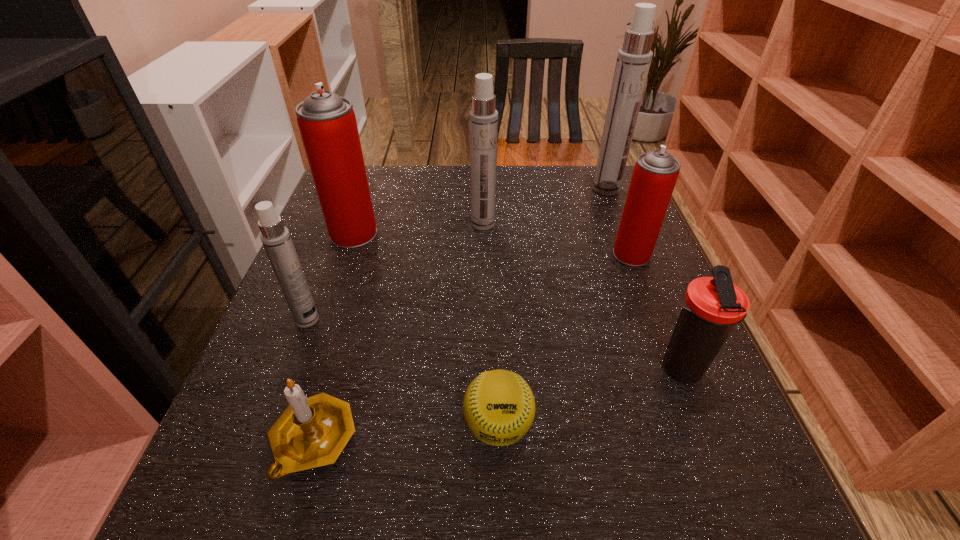
The width and height of the screenshot is (960, 540). In order to click on the farthest aerosol can in this screenshot , I will do `click(633, 62)`.

In order to click on the tallest object in this screenshot , I will do `click(633, 62)`.

Find the location of `the second smallest white aerosol can`. the second smallest white aerosol can is located at coordinates (483, 118).

Where is `the third aerosol can from left to right`? This screenshot has width=960, height=540. the third aerosol can from left to right is located at coordinates (483, 118).

I want to click on the left red aerosol can, so click(x=327, y=123).

You are a GUI agent. You are given a task and a screenshot of the screen. Output one action in this format:
    pyautogui.click(x=<x>, y=<y>)
    Task: Click on the right red aerosol can
    
    Given the screenshot: What is the action you would take?
    pyautogui.click(x=655, y=173)

This screenshot has width=960, height=540. I want to click on the nearest white aerosol can, so coord(275,237).

At what (x,y) coordinates should I click in order to perform the action: click on the leftmost white aerosol can. Please return your answer as a coordinate pair (x, y). Image resolution: width=960 pixels, height=540 pixels. Looking at the image, I should click on (275, 237).

You are a GUI agent. You are given a task and a screenshot of the screen. Output one action in this format:
    pyautogui.click(x=<x>, y=<y>)
    Task: Click on the thermos bottle
    
    Given the screenshot: What is the action you would take?
    pyautogui.click(x=711, y=306)

This screenshot has height=540, width=960. What are the coordinates of `the sixth tallest object` in the screenshot? It's located at (711, 306).